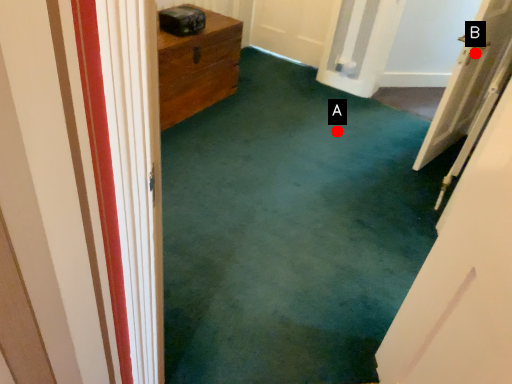
Question: Two points are circled on the image, labeled by A and B beside each circle. Among these points, which one is nearest to the camera?

Choices:
 (A) A is closer
 (B) B is closer

Answer: (B)